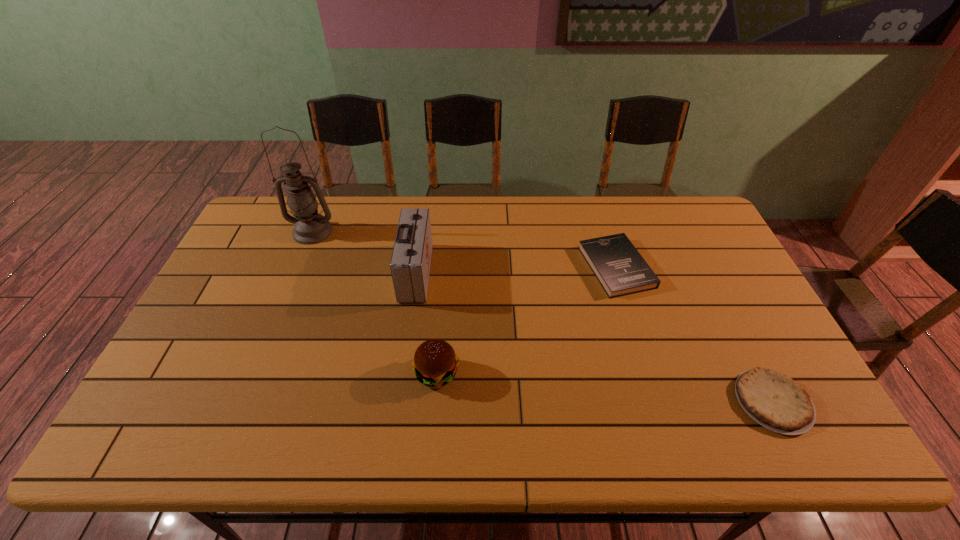
The width and height of the screenshot is (960, 540). In order to click on unoccupied area between the first-aid kit and the leftmost object in this screenshot , I will do `click(365, 252)`.

You are a GUI agent. You are given a task and a screenshot of the screen. Output one action in this format:
    pyautogui.click(x=<x>, y=<y>)
    Task: Click on the free space between the rightmost object and the leftmost object
    The image size is (960, 540).
    Given the screenshot: What is the action you would take?
    pyautogui.click(x=542, y=317)

Where is `vacant point located between the tallest object and the first-aid kit`? vacant point located between the tallest object and the first-aid kit is located at coordinates (365, 252).

Locate an element on the screen. free space that is in between the hamburger and the first-aid kit is located at coordinates (426, 323).

Find the location of a particular element. The width and height of the screenshot is (960, 540). vacant space that is in between the rightmost object and the first-aid kit is located at coordinates (594, 337).

I want to click on the third closest object to the first-aid kit, so click(x=621, y=270).

Identify which object is the closest to the third tallest object. Please provide its 2D coordinates. Your answer should be formatted as a tuple, i.e. [(x, y)], where the tuple contains the x and y coordinates of a point satisfying the conditions above.

[(410, 263)]

I want to click on free point that satisfies the following two spatial constraints: 1. on the front-facing side of the rightmost object; 2. on the right side of the first-aid kit, so click(398, 402).

Find the location of a particular element. Image resolution: width=960 pixels, height=540 pixels. free space that satisfies the following two spatial constraints: 1. on the front side of the fourth tallest object; 2. on the left side of the leftmost object is located at coordinates (299, 267).

Find the location of a particular element. The image size is (960, 540). blank space that satisfies the following two spatial constraints: 1. on the front side of the leftmost object; 2. on the left side of the second shortest object is located at coordinates (299, 267).